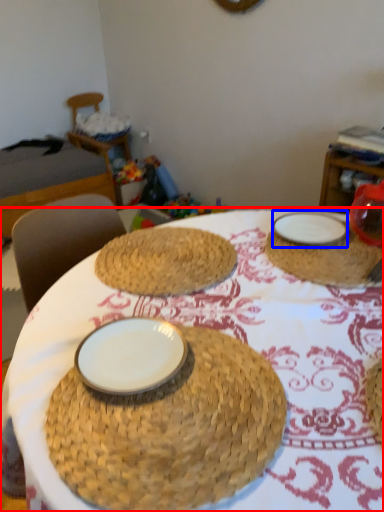
Question: Which object appears farthest to the camera in this image, table (highlighted by a red box) or plate (highlighted by a blue box)?

Choices:
 (A) table
 (B) plate

Answer: (B)